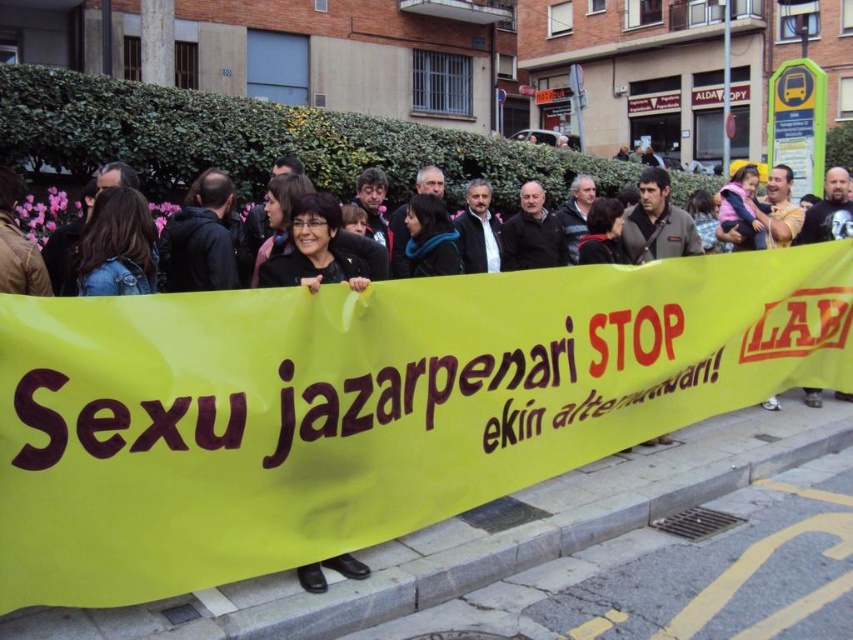
Based on the scene description, where is the yellow fabric banner at center located in terms of coordinates?

The yellow fabric banner at center is located at point (364, 406).

You are a photographer trying to capture a closeup of the protest banner. You notice two points on the banner labeled as point (361, 461) and point (314, 198). Which point should you focus on to get a clearer image of the banner?

Point (361, 461) is closer to the camera than point (314, 198), so focusing on point (361, 461) will provide a clearer image of the banner.

Based on the photo, you are a photographer trying to capture the entire banner in your shot. You are standing at point (622,333). To get a better angle, you decide to move to point (364,250). Will moving to this new position allow you to see more of the banner?

Point (622,333) is behind point (364,250). Moving to point (364,250) will bring you closer to the front, allowing you to see more of the banner.